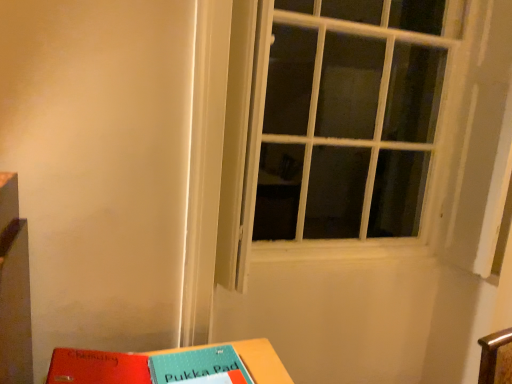
Question: Is white textured window at center taller than matte plastic table at lower center?

Choices:
 (A) no
 (B) yes

Answer: (B)

Question: Is white textured window at center surrounding matte plastic table at lower center?

Choices:
 (A) yes
 (B) no

Answer: (B)

Question: Is white textured window at center shorter than matte plastic table at lower center?

Choices:
 (A) no
 (B) yes

Answer: (A)

Question: From a real-world perspective, is white textured window at center physically below matte plastic table at lower center?

Choices:
 (A) yes
 (B) no

Answer: (B)

Question: From the image's perspective, is white textured window at center below matte plastic table at lower center?

Choices:
 (A) no
 (B) yes

Answer: (A)

Question: Is white textured window at center bigger than matte plastic table at lower center?

Choices:
 (A) no
 (B) yes

Answer: (B)

Question: Considering the relative sizes of white textured window at center and red matte paper at lower left in the image provided, is white textured window at center bigger than red matte paper at lower left?

Choices:
 (A) no
 (B) yes

Answer: (B)

Question: Could you tell me if white textured window at center is turned towards red matte paper at lower left?

Choices:
 (A) yes
 (B) no

Answer: (B)

Question: Is white textured window at center closer to camera compared to red matte paper at lower left?

Choices:
 (A) no
 (B) yes

Answer: (A)

Question: Can you confirm if white textured window at center is wider than red matte paper at lower left?

Choices:
 (A) no
 (B) yes

Answer: (A)

Question: Does white textured window at center have a lesser height compared to red matte paper at lower left?

Choices:
 (A) no
 (B) yes

Answer: (A)

Question: From the image's perspective, would you say white textured window at center is shown under red matte paper at lower left?

Choices:
 (A) no
 (B) yes

Answer: (A)

Question: Is matte plastic table at lower center wider than white textured window at center?

Choices:
 (A) no
 (B) yes

Answer: (B)